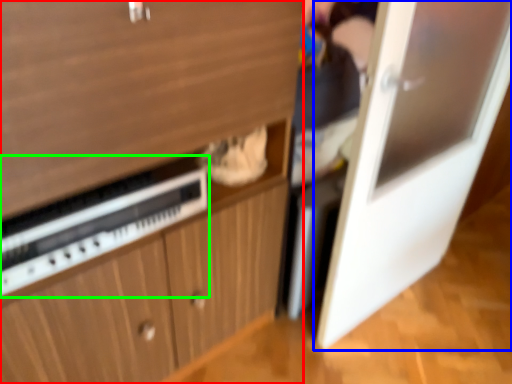
Question: Considering the real-world distances, which object is farthest from cabinetry (highlighted by a red box)? door (highlighted by a blue box) or appliance (highlighted by a green box)?

Choices:
 (A) door
 (B) appliance

Answer: (A)